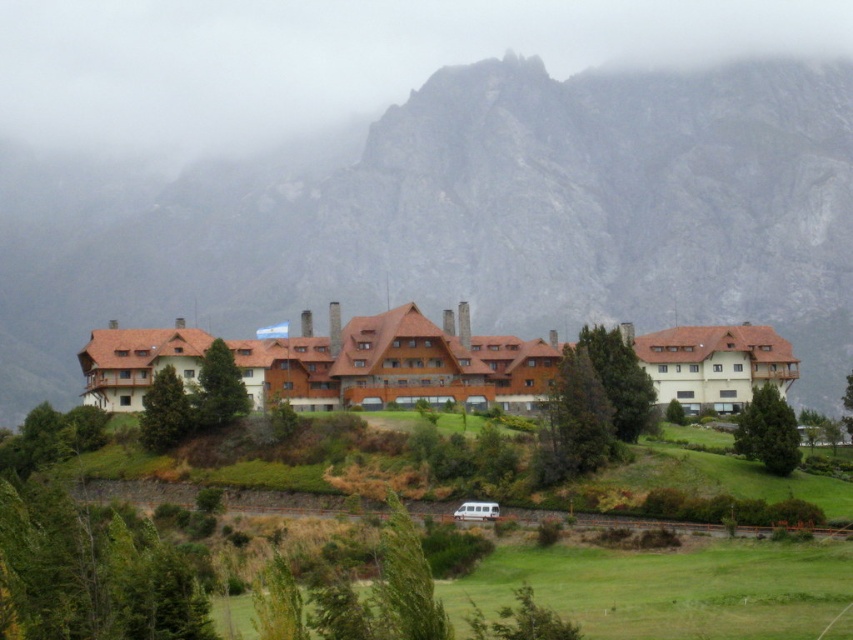
Question: Is rugged stone mountain at center bigger than foggy rock at upper center?

Choices:
 (A) yes
 (B) no

Answer: (A)

Question: Which point appears closest to the camera in this image?

Choices:
 (A) (674, 292)
 (B) (276, 131)

Answer: (A)

Question: Does rugged stone mountain at center appear on the left side of foggy rock at upper center?

Choices:
 (A) yes
 (B) no

Answer: (B)

Question: Is rugged stone mountain at center positioned at the back of foggy rock at upper center?

Choices:
 (A) yes
 (B) no

Answer: (B)